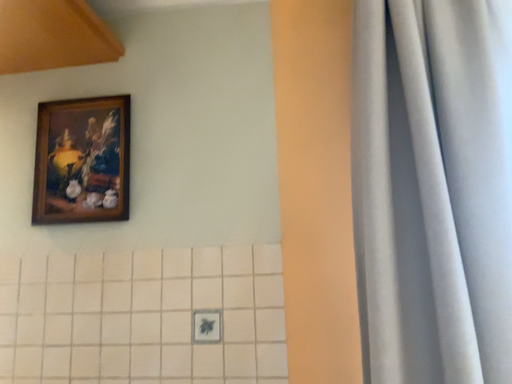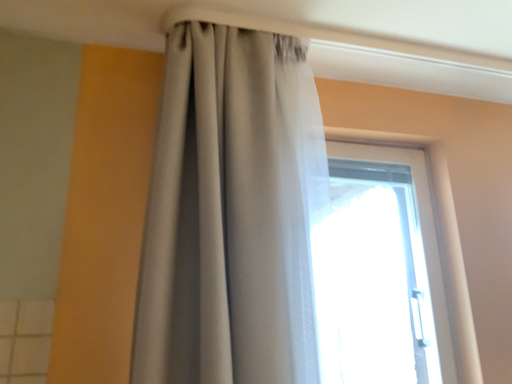
Question: Which way did the camera rotate in the video?

Choices:
 (A) rotated right
 (B) rotated left

Answer: (A)